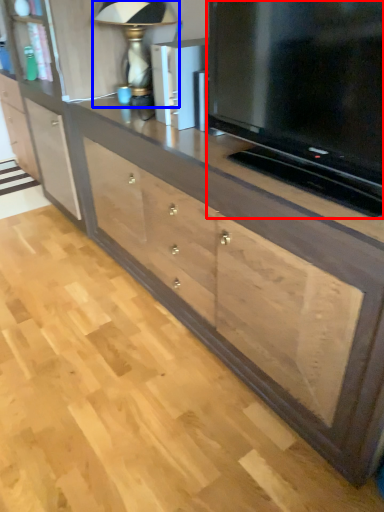
Question: Which point is closer to the camera, television (highlighted by a red box) or table lamp (highlighted by a blue box)?

Choices:
 (A) television
 (B) table lamp

Answer: (A)